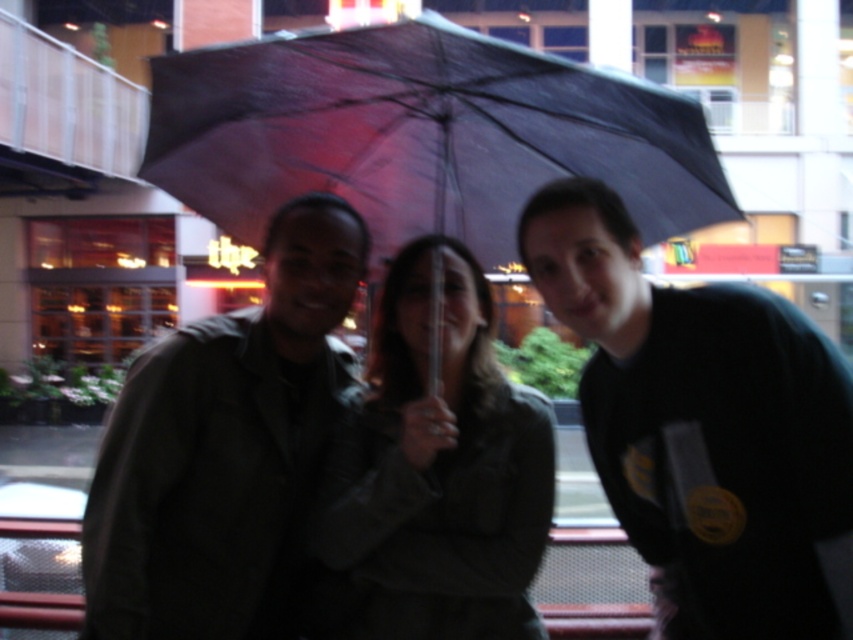
Question: Which of the following is the closest to the observer?

Choices:
 (A) click(701, 422)
 (B) click(668, 161)

Answer: (A)

Question: Among these objects, which one is farthest from the camera?

Choices:
 (A) matte black jacket at center
 (B) matte green jacket at center

Answer: (A)

Question: Can you confirm if transparent plastic umbrella at center is thinner than black matte shirt at right?

Choices:
 (A) no
 (B) yes

Answer: (A)

Question: Which of the following is the farthest from the observer?

Choices:
 (A) black matte shirt at right
 (B) matte black umbrella at center

Answer: (B)

Question: Can you confirm if black matte shirt at right is positioned to the right of matte green jacket at center?

Choices:
 (A) yes
 (B) no

Answer: (A)

Question: Does transparent plastic umbrella at center appear under black matte shirt at right?

Choices:
 (A) no
 (B) yes

Answer: (A)